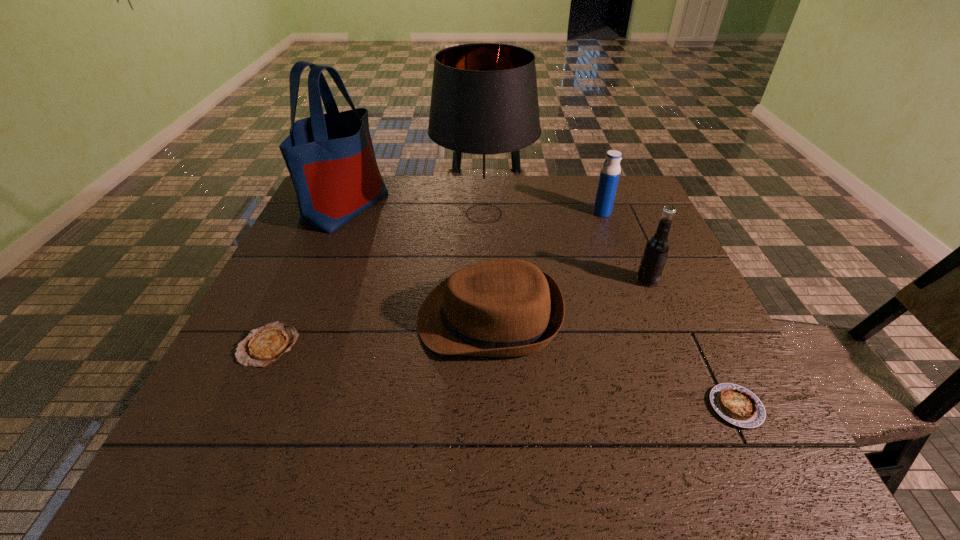
At what (x,y) coordinates should I click in order to perform the action: click on free space between the handbag and the farther quiche. Please return your answer as a coordinate pair (x, y). The image size is (960, 540). Looking at the image, I should click on (307, 276).

Find the location of `free space between the root beer and the handbag`. free space between the root beer and the handbag is located at coordinates (496, 244).

Identify the location of empty space between the nearest object and the water bottle. (669, 310).

You are a GUI agent. You are given a task and a screenshot of the screen. Output one action in this format:
    pyautogui.click(x=<x>, y=<y>)
    Task: Click on the free space between the handbag and the root beer
    
    Given the screenshot: What is the action you would take?
    pyautogui.click(x=496, y=244)

Locate an element on the screen. blank region between the root beer and the handbag is located at coordinates (496, 244).

Where is `object identified as the fifth closest to the fedora`? object identified as the fifth closest to the fedora is located at coordinates (737, 405).

Locate an element on the screen. the fifth closest object to the root beer is located at coordinates (330, 157).

You are a GUI agent. You are given a task and a screenshot of the screen. Output one action in this format:
    pyautogui.click(x=<x>, y=<y>)
    Task: Click on the free region that satisfies the following two spatial constraints: 1. on the front side of the handbag; 2. on the right side of the water bottle
    This screenshot has width=960, height=540.
    Given the screenshot: What is the action you would take?
    pyautogui.click(x=344, y=213)